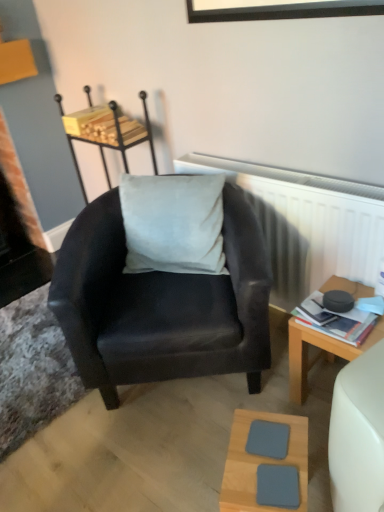
Identify the location of hardcover book at right. The width and height of the screenshot is (384, 512). (335, 320).

Describe the element at coordinates (306, 223) in the screenshot. I see `white matte radiator at upper center` at that location.

In order to face light wood/texture square coaster at lower center, should I rotate leftwards or rightwards?

Turn right by 10.049 degrees to look at light wood/texture square coaster at lower center.

The width and height of the screenshot is (384, 512). What do you see at coordinates (319, 353) in the screenshot? I see `wooden desk at right` at bounding box center [319, 353].

Measure the distance between wooden desk at right and camera.

wooden desk at right and camera are 3.83 feet apart.

The height and width of the screenshot is (512, 384). I want to click on light gray fabric stool at center, so click(106, 131).

Which object is closer to the camera taking this photo, wooden desk at right or suede black armchair at center?

suede black armchair at center is closer to the camera.

Which object is thinner, wooden desk at right or suede black armchair at center?

With smaller width is wooden desk at right.

Which of these two, wooden desk at right or suede black armchair at center, stands shorter?

wooden desk at right.

From the image's perspective, does wooden desk at right appear higher than suede black armchair at center?

No, from the image's perspective, wooden desk at right is not over suede black armchair at center.

Considering the positions of objects suede black armchair at center and wooden desk at right in the image provided, who is more to the left, suede black armchair at center or wooden desk at right?

From the viewer's perspective, suede black armchair at center appears more on the left side.

Is suede black armchair at center facing towards wooden desk at right?

No, suede black armchair at center is not oriented towards wooden desk at right.

From a real-world perspective, which is physically above, suede black armchair at center or wooden desk at right?

suede black armchair at center, from a real-world perspective.

In the image, is suede black armchair at center positioned in front of or behind wooden desk at right?

In the image, suede black armchair at center appears in front of wooden desk at right.

The height and width of the screenshot is (512, 384). There is a hardcover book at right. Identify the location of stool above it (from a real-world perspective). (106, 131).

Are hardcover book at right and light gray fabric stool at center far apart?

hardcover book at right is far away from light gray fabric stool at center.

Which object is positioned more to the left, hardcover book at right or light gray fabric stool at center?

light gray fabric stool at center.

From the picture: Is the position of hardcover book at right more distant than that of light gray fabric stool at center?

No, hardcover book at right is in front of light gray fabric stool at center.

Is wooden desk at right beside white matte radiator at upper center?

No.

Does point (293, 372) lie behind point (280, 244)?

No, it is not.

From the image's perspective, relative to white matte radiator at upper center, is wooden desk at right above or below?

wooden desk at right is below white matte radiator at upper center.

Based on the photo, can you confirm if wooden desk at right is positioned to the left of white matte radiator at upper center?

Incorrect, wooden desk at right is not on the left side of white matte radiator at upper center.

Is hardcover book at right further to camera compared to white matte radiator at upper center?

No, hardcover book at right is closer to the viewer.

From a real-world perspective, between hardcover book at right and white matte radiator at upper center, who is vertically higher?

white matte radiator at upper center.

In order to click on radiator on the left side of hardcover book at right in this screenshot , I will do `click(306, 223)`.

Based on the photo, how different are the orientations of hardcover book at right and white matte radiator at upper center in degrees?

1.23 degrees.

Looking at the image, does suede black armchair at center seem bigger or smaller compared to hardcover book at right?

In the image, suede black armchair at center appears to be larger than hardcover book at right.

Is suede black armchair at center facing away from hardcover book at right?

suede black armchair at center is not turned away from hardcover book at right.

Looking at this image, can we say suede black armchair at center lies outside hardcover book at right?

Yes, suede black armchair at center is not within hardcover book at right.

Which point is more forward, (264,280) or (325,330)?

Point (325,330)

Considering the positions of points (352, 318) and (183, 308), is point (352, 318) farther from camera compared to point (183, 308)?

No, (352, 318) is closer to viewer.

Looking at this image, which is correct: hardcover book at right is inside suede black armchair at center, or outside of it?

hardcover book at right is spatially situated outside suede black armchair at center.

Which object is closer to the camera taking this photo, hardcover book at right or suede black armchair at center?

suede black armchair at center is closer to the camera.

Locate an element on the screen. The width and height of the screenshot is (384, 512). chair lying above the hardcover book at right (from the image's perspective) is located at coordinates [161, 305].

Where is `chair on the left side of wooden desk at right`? Image resolution: width=384 pixels, height=512 pixels. chair on the left side of wooden desk at right is located at coordinates (161, 305).

You are a GUI agent. You are given a task and a screenshot of the screen. Output one action in this format:
    pyautogui.click(x=<x>, y=<y>)
    Task: Click on the desk below the suede black armchair at center (from the image's perspective)
    
    Given the screenshot: What is the action you would take?
    pyautogui.click(x=319, y=353)

From the picture: Looking at the image, which one is located further to white matte radiator at upper center, hardcover book at right or light gray fabric stool at center?

light gray fabric stool at center is further to white matte radiator at upper center.

Which object lies further to the anchor point suede black armchair at center, white matte radiator at upper center or hardcover book at right?

hardcover book at right is positioned further to the anchor suede black armchair at center.

Which object lies further to the anchor point wooden desk at right, light wood/texture square coaster at lower center or suede black armchair at center?

The object further to wooden desk at right is suede black armchair at center.

Considering their positions, is light gray fabric stool at center positioned closer to white matte radiator at upper center than suede black armchair at center?

suede black armchair at center is closer to white matte radiator at upper center.

When comparing their distances from light wood/texture square coaster at lower center, does light gray fabric stool at center or hardcover book at right seem closer?

The object closer to light wood/texture square coaster at lower center is hardcover book at right.

Considering their positions, is white matte radiator at upper center positioned closer to suede black armchair at center than light gray fabric stool at center?

white matte radiator at upper center.

Based on the photo, from the image, which object appears to be nearer to wooden desk at right, light gray fabric stool at center or hardcover book at right?

Based on the image, hardcover book at right appears to be nearer to wooden desk at right.

Considering their positions, is light gray fabric stool at center positioned further to light wood/texture square coaster at lower center than white matte radiator at upper center?

Based on the image, light gray fabric stool at center appears to be further to light wood/texture square coaster at lower center.

Find the location of a particular element. This screenshot has width=384, height=512. desk that lies between light gray fabric stool at center and light wood/texture square coaster at lower center from top to bottom is located at coordinates (319, 353).

Locate an element on the screen. Image resolution: width=384 pixels, height=512 pixels. book between suede black armchair at center and wooden desk at right from left to right is located at coordinates (335, 320).

Identify the location of table located between suede black armchair at center and wooden desk at right in the left-right direction. (260, 462).

You are a GUI agent. You are given a task and a screenshot of the screen. Output one action in this format:
    pyautogui.click(x=<x>, y=<y>)
    Task: Click on the book between light gray fabric stool at center and wooden desk at right from left to right
    The height and width of the screenshot is (512, 384).
    Given the screenshot: What is the action you would take?
    pyautogui.click(x=335, y=320)